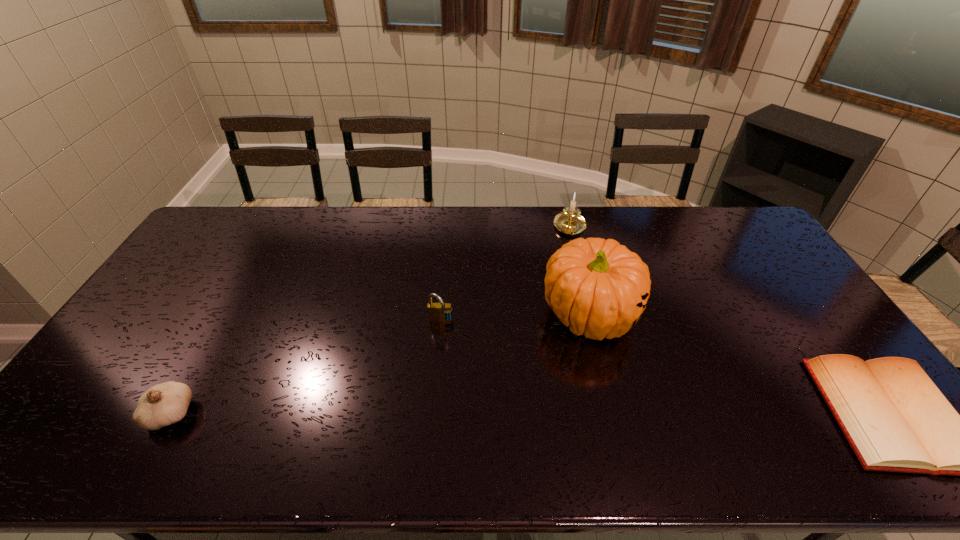
Locate an element on the screen. vacant point that satisfies the following two spatial constraints: 1. on the back side of the garlic; 2. on the left side of the second tallest object is located at coordinates (276, 227).

In order to click on vacant region that satisfies the following two spatial constraints: 1. on the back side of the garlic; 2. on the right side of the padlock in this screenshot , I will do coord(224,322).